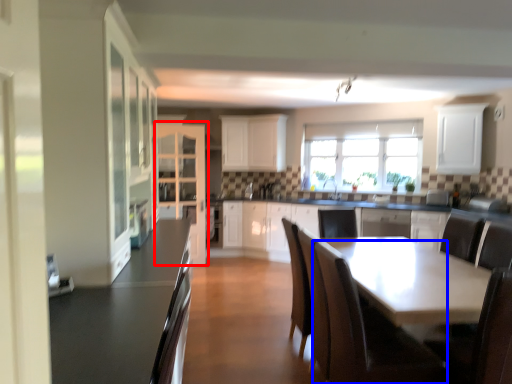
Question: Which object appears closest to the camera in this image, cabinetry (highlighted by a red box) or chair (highlighted by a blue box)?

Choices:
 (A) cabinetry
 (B) chair

Answer: (B)